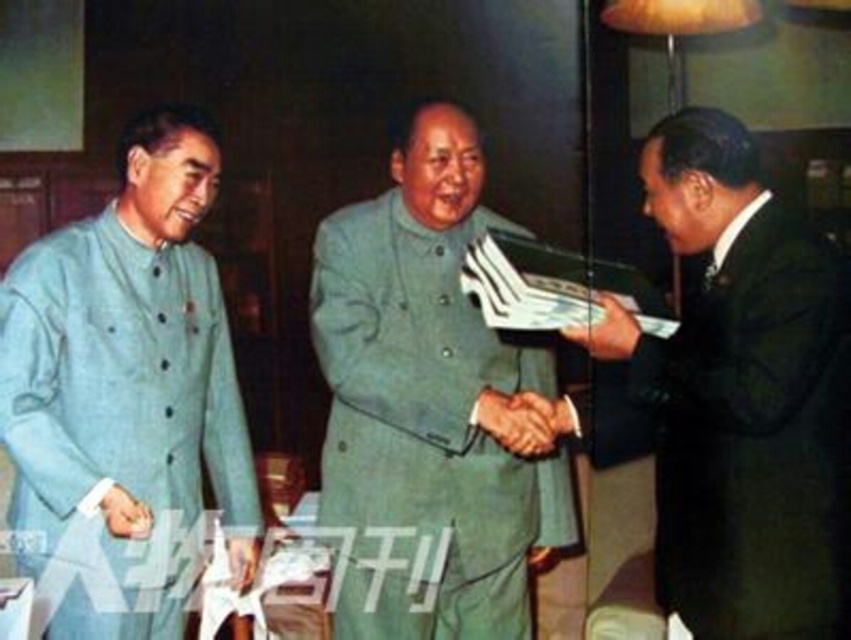
In the scene shown: Does dark green suit at right have a lesser height compared to smooth skin hand at center?

Incorrect, dark green suit at right's height does not fall short of smooth skin hand at center's.

Identify the location of dark green suit at right. The width and height of the screenshot is (851, 640). pos(746,397).

What do you see at coordinates (746, 397) in the screenshot? This screenshot has height=640, width=851. I see `dark green suit at right` at bounding box center [746, 397].

Locate an element on the screen. This screenshot has width=851, height=640. dark green suit at right is located at coordinates (746, 397).

This screenshot has width=851, height=640. What do you see at coordinates (430, 406) in the screenshot? I see `green matte uniform at center` at bounding box center [430, 406].

Is point (343, 321) farther from camera compared to point (610, 358)?

Yes, point (343, 321) is farther from viewer.

Locate an element on the screen. This screenshot has height=640, width=851. green matte uniform at center is located at coordinates (430, 406).

Between point (54, 324) and point (587, 346), which one is positioned in front?

Positioned in front is point (54, 324).

Does light blue fabric jacket at left appear on the right side of smooth leather wallet at center?

Incorrect, light blue fabric jacket at left is not on the right side of smooth leather wallet at center.

The image size is (851, 640). In order to click on light blue fabric jacket at left in this screenshot , I will do `click(126, 392)`.